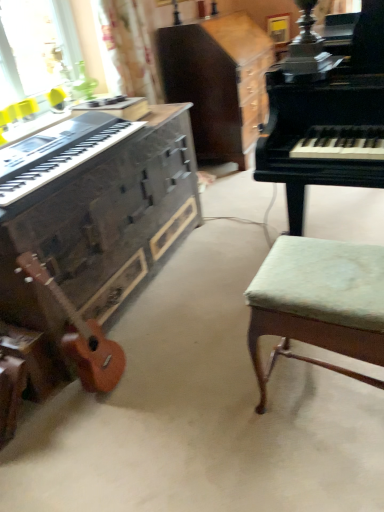
At what (x,y) coordinates should I click in order to perform the action: click on vacant space situated on the left part of black polished piano at upper right, arranged as the 2th piano when viewed from the left. Please return your answer as a coordinate pair (x, y). Looking at the image, I should click on (218, 264).